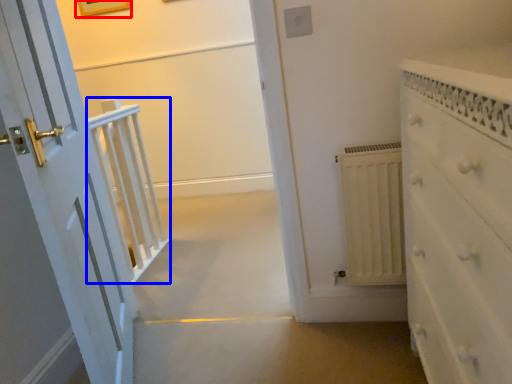
Question: Which object appears closest to the camera in this image, picture frame (highlighted by a red box) or balustrade (highlighted by a blue box)?

Choices:
 (A) picture frame
 (B) balustrade

Answer: (B)